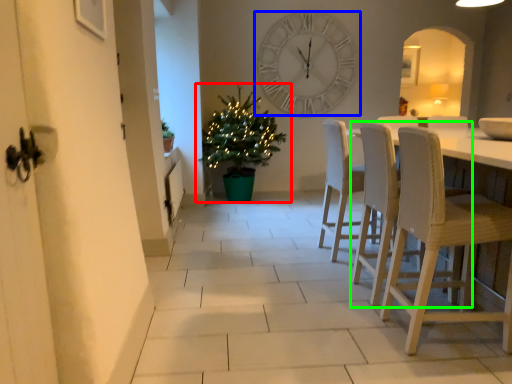
Question: Based on their relative distances, which object is farther from houseplant (highlighted by a red box)? Choose from wall clock (highlighted by a blue box) and chair (highlighted by a green box).

Choices:
 (A) wall clock
 (B) chair

Answer: (B)